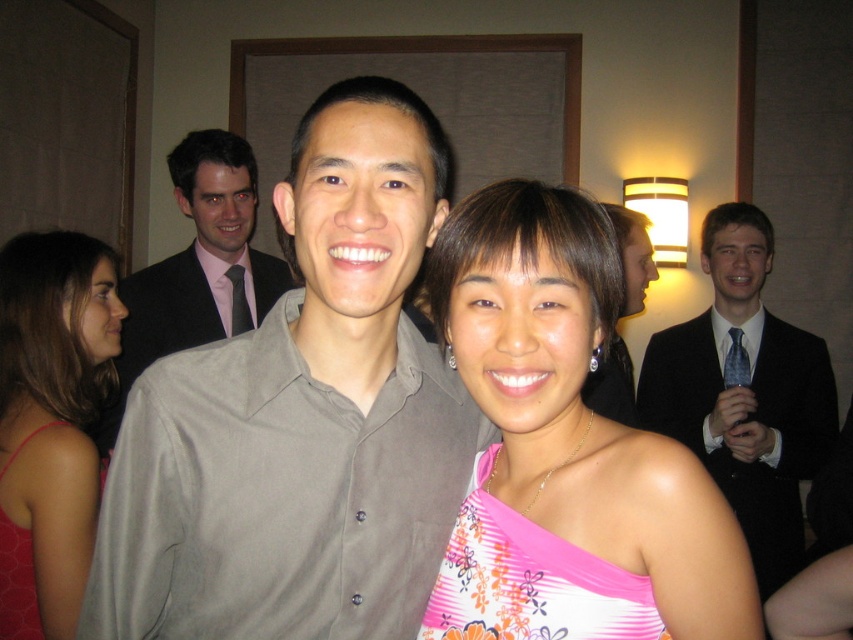
Question: Can you confirm if matte gray shirt at center is smaller than shiny black suit at right?

Choices:
 (A) yes
 (B) no

Answer: (A)

Question: Which point appears farthest from the camera in this image?

Choices:
 (A) (125, 346)
 (B) (483, 500)

Answer: (A)

Question: Does pink floral dress at center come behind red fabric dress at left?

Choices:
 (A) no
 (B) yes

Answer: (A)

Question: Among these objects, which one is nearest to the camera?

Choices:
 (A) shiny black suit at right
 (B) matte gray shirt at center
 (C) red fabric dress at left
 (D) pink floral dress at center

Answer: (D)

Question: Does pink floral dress at center have a lesser width compared to gray matte shirt at center?

Choices:
 (A) yes
 (B) no

Answer: (A)

Question: Which point is farther from the camera taking this photo?

Choices:
 (A) pos(42,548)
 (B) pos(241,224)
 (C) pos(793,337)
 (D) pos(404,577)

Answer: (C)